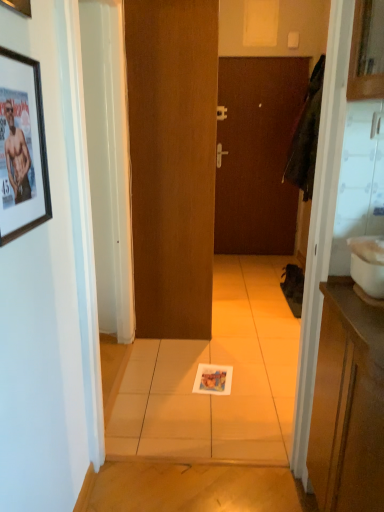
Identify the location of vacant area that is in front of brown matte door at center, which is the 2th door in front-to-back order. (250, 267).